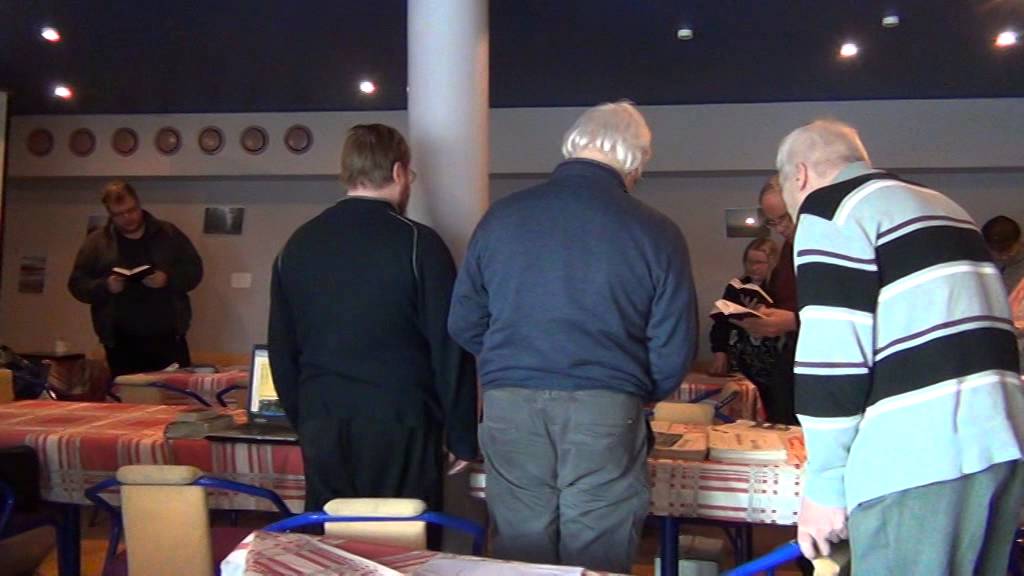
The image size is (1024, 576). Identify the location of open books. (735, 310), (756, 284), (128, 269).